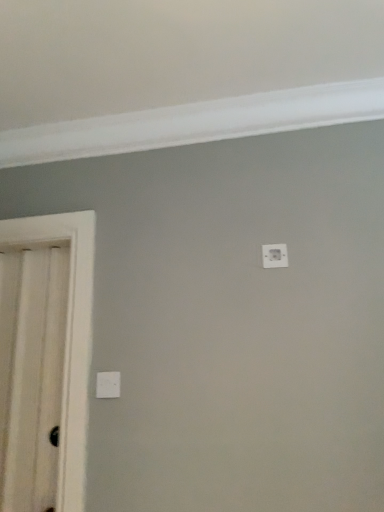
Question: Should I look upward or downward to see white glossy door at left?

Choices:
 (A) up
 (B) down

Answer: (B)

Question: Does white plastic light switch at upper center, which is counted as the 1th light switch, starting from the right, turn towards white glossy door at left?

Choices:
 (A) no
 (B) yes

Answer: (A)

Question: Considering the relative sizes of white plastic light switch at upper center, which is counted as the 1th light switch, starting from the right, and white glossy door at left in the image provided, is white plastic light switch at upper center, which is counted as the 1th light switch, starting from the right, wider than white glossy door at left?

Choices:
 (A) no
 (B) yes

Answer: (A)

Question: Can you confirm if white plastic light switch at upper center, arranged as the second light switch when ordered from the bottom, is bigger than white glossy door at left?

Choices:
 (A) yes
 (B) no

Answer: (B)

Question: Can you confirm if white plastic light switch at upper center, arranged as the second light switch when ordered from the bottom, is shorter than white glossy door at left?

Choices:
 (A) no
 (B) yes

Answer: (B)

Question: From the image's perspective, is white plastic light switch at upper center, the 1th light switch positioned from the top, beneath white glossy door at left?

Choices:
 (A) no
 (B) yes

Answer: (A)

Question: Is white plastic light switch at upper center, arranged as the second light switch when ordered from the bottom, next to white glossy door at left and touching it?

Choices:
 (A) yes
 (B) no

Answer: (B)

Question: Would you say white glossy door at left is part of white plastic light switch at lower center, positioned as the second light switch in right-to-left order,'s contents?

Choices:
 (A) no
 (B) yes

Answer: (A)

Question: Is white plastic light switch at lower center, marked as the 1th light switch in a bottom-to-top arrangement, shorter than white glossy door at left?

Choices:
 (A) yes
 (B) no

Answer: (A)

Question: Is white glossy door at left at the back of white plastic light switch at lower center, marked as the 1th light switch in a bottom-to-top arrangement?

Choices:
 (A) yes
 (B) no

Answer: (B)

Question: Could you tell me if white plastic light switch at lower center, arranged as the second light switch when viewed from the top, is facing white glossy door at left?

Choices:
 (A) yes
 (B) no

Answer: (B)

Question: Is white plastic light switch at lower center, positioned as the second light switch in right-to-left order, far from white glossy door at left?

Choices:
 (A) no
 (B) yes

Answer: (A)

Question: Is white plastic light switch at lower center, marked as the 1th light switch in a bottom-to-top arrangement, in front of white glossy door at left?

Choices:
 (A) yes
 (B) no

Answer: (B)

Question: From the image's perspective, is white glossy door at left beneath white plastic light switch at upper center, the 1th light switch positioned from the top?

Choices:
 (A) yes
 (B) no

Answer: (A)